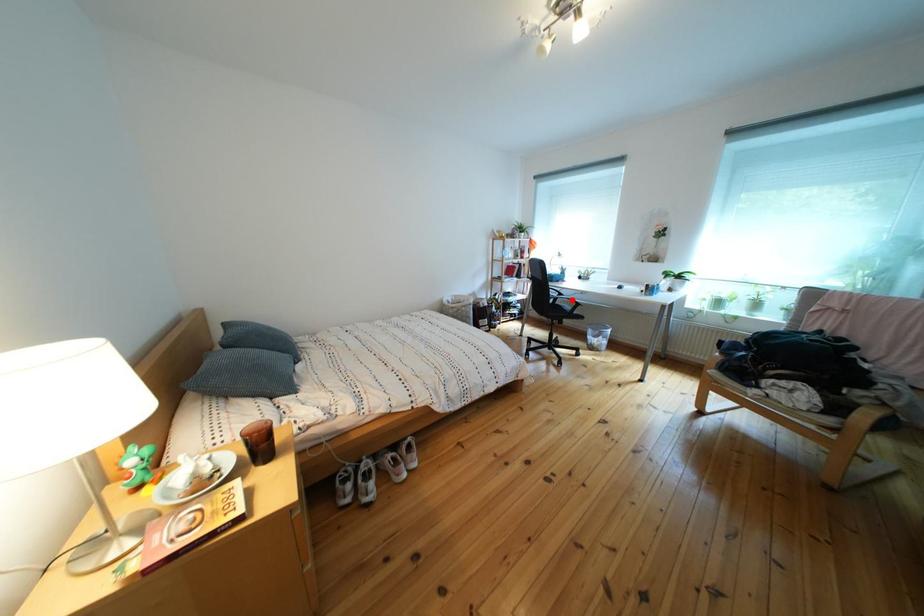
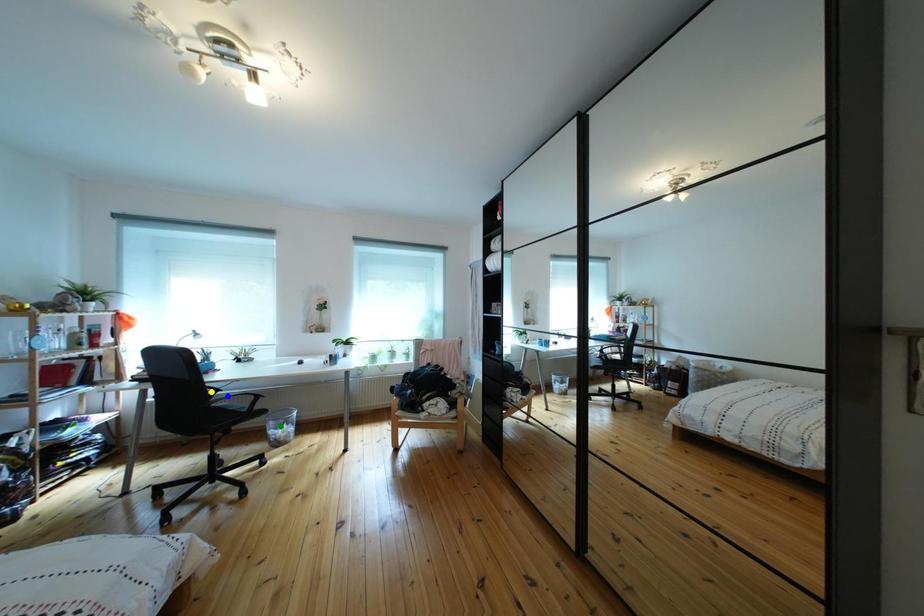
Question: I am providing you with two images of the same scene from different viewpoints. A red point is marked on the first image. You are given multiple points on the second image. Which point in image 2 represents the same 3d spot as the red point in image 1?

Choices:
 (A) yellow point
 (B) blue point
 (C) green point

Answer: (B)